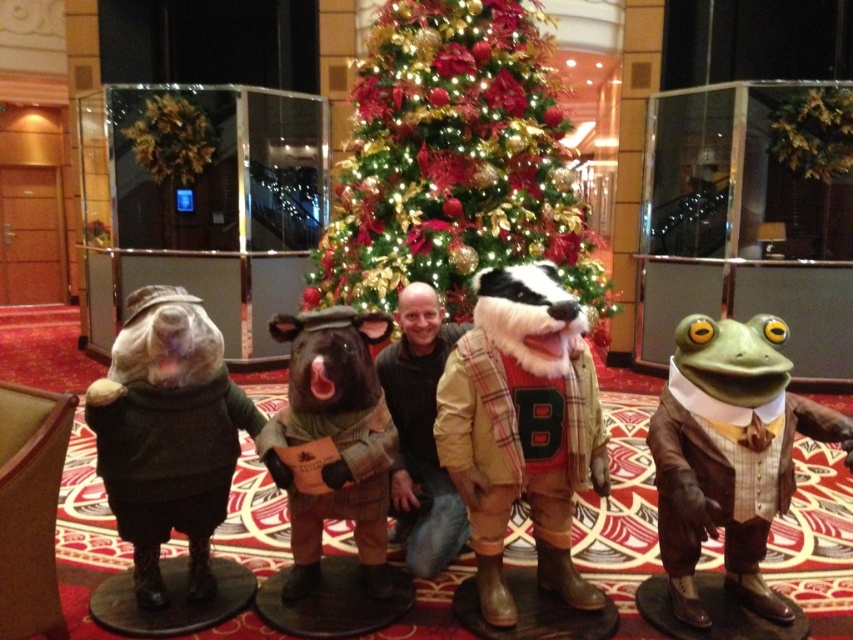
Question: Does green shiny christmas tree at center lie in front of matte brown plush bear at left?

Choices:
 (A) no
 (B) yes

Answer: (A)

Question: Which point is closer to the camera?

Choices:
 (A) green shiny christmas tree at center
 (B) dark brown leather jacket at center
 (C) green matte frog at right
 (D) fuzzy beige jacket at center

Answer: (C)

Question: Does matte brown plush bear at left appear over green fabric frog at center?

Choices:
 (A) no
 (B) yes

Answer: (B)

Question: Does green matte frog at right appear under dark brown leather jacket at center?

Choices:
 (A) no
 (B) yes

Answer: (B)

Question: Which is farther from the green shiny christmas tree at center?

Choices:
 (A) green fabric frog at center
 (B) green matte frog at right

Answer: (B)

Question: Estimate the real-world distances between objects in this image. Which object is farther from the fuzzy beige jacket at center?

Choices:
 (A) green shiny christmas tree at center
 (B) matte brown plush bear at left

Answer: (A)